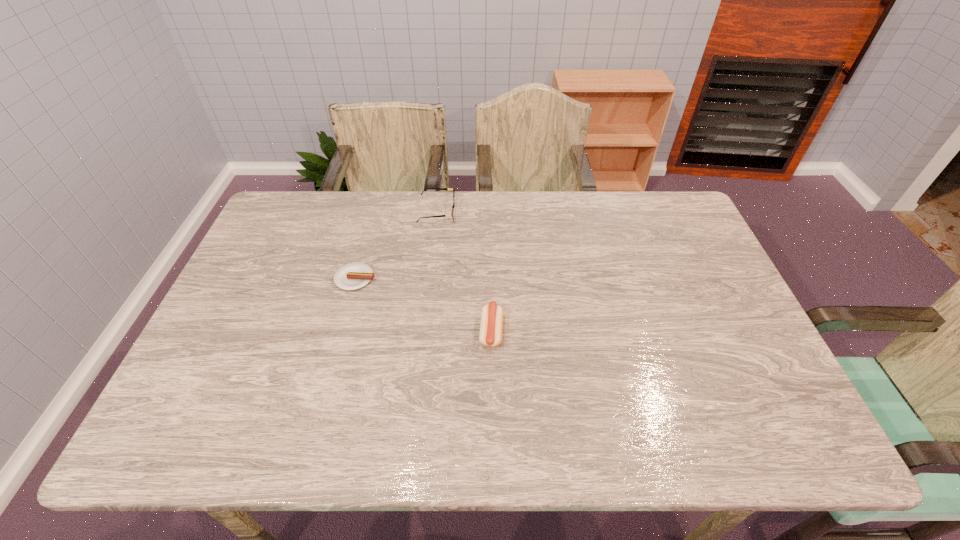
This screenshot has height=540, width=960. What are the coordinates of `spectacles` in the screenshot? It's located at (452, 214).

Find the location of `the second object from right to left`. the second object from right to left is located at coordinates (452, 214).

The width and height of the screenshot is (960, 540). Identify the location of the taller sausage. (491, 325).

What are the coordinates of `the rightmost object` in the screenshot? It's located at (491, 325).

Where is `the farther sausage`? This screenshot has height=540, width=960. the farther sausage is located at coordinates (351, 276).

Where is `the shortest object`? the shortest object is located at coordinates (351, 276).

Where is `free spot located on the front-facing side of the second object from left to right`? free spot located on the front-facing side of the second object from left to right is located at coordinates (492, 212).

Find the location of `free region located on the right of the nearer sausage`. free region located on the right of the nearer sausage is located at coordinates (615, 331).

Find the location of a particular element. The image size is (960, 540). free space located on the front of the farther sausage is located at coordinates (342, 330).

Where is `object that is at the far edge`? The height and width of the screenshot is (540, 960). object that is at the far edge is located at coordinates 452,214.